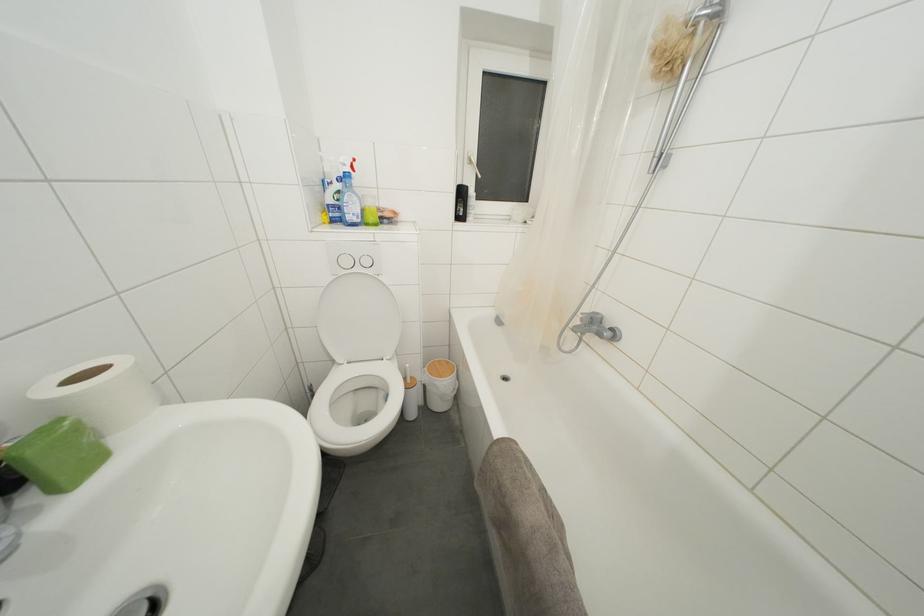
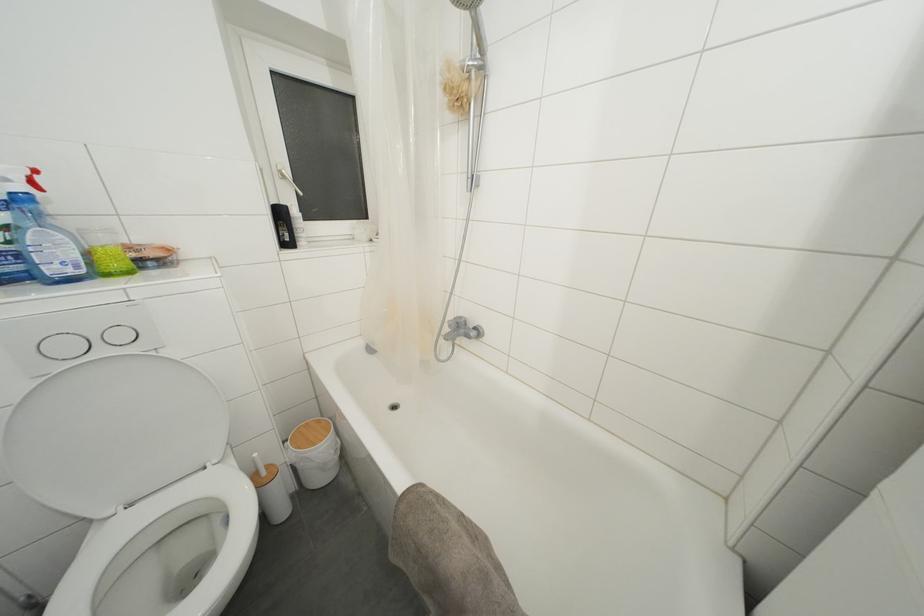
Locate, in the second image, the point that corresponds to (x=411, y=370) in the first image.

(260, 459)